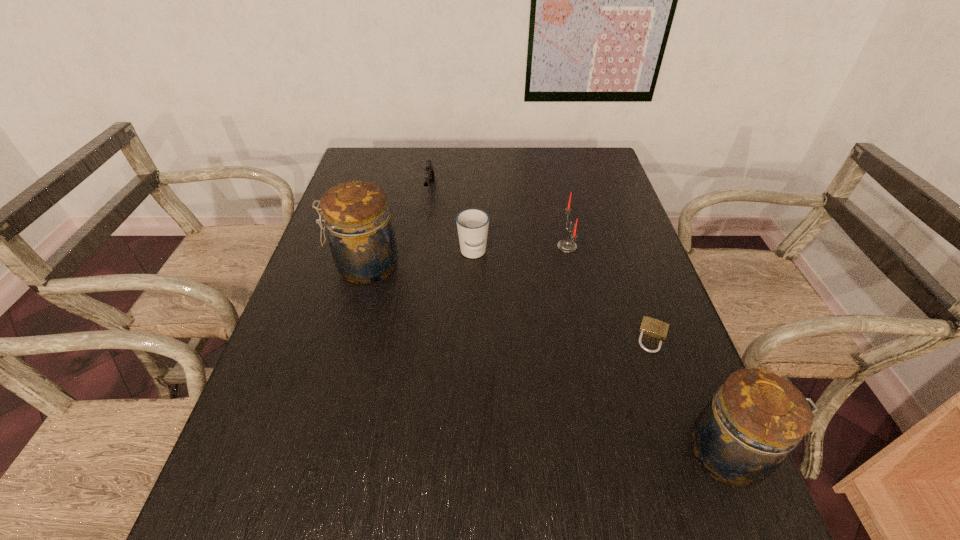
You are a GUI agent. You are given a task and a screenshot of the screen. Output one action in this format:
    pyautogui.click(x=<x>, y=<y>)
    Task: Click on the fifth farthest object
    
    Given the screenshot: What is the action you would take?
    pyautogui.click(x=652, y=327)

This screenshot has height=540, width=960. Identify the location of padlock. (652, 327).

You are a GUI agent. You are given a task and a screenshot of the screen. Output one action in this format:
    pyautogui.click(x=<x>, y=<y>)
    Task: Click on the vacant space located 0.170m with a handle on the side of the third shortest object
    This screenshot has width=960, height=540.
    Given the screenshot: What is the action you would take?
    pyautogui.click(x=472, y=314)

This screenshot has height=540, width=960. I want to click on free point located at the end of the barrel of the fifth object from right to left, so click(425, 220).

Find the location of a particular element. free space located on the front-facing side of the third object from right to left is located at coordinates (467, 246).

Find the location of `vacant space located 0.250m on the front-facing side of the third object from right to left`. vacant space located 0.250m on the front-facing side of the third object from right to left is located at coordinates (467, 246).

You are a GUI agent. You are given a task and a screenshot of the screen. Output one action in this format:
    pyautogui.click(x=<x>, y=<y>)
    Task: Click on the vacant space located 0.230m on the front-facing side of the third object from right to left
    
    Given the screenshot: What is the action you would take?
    pyautogui.click(x=474, y=246)

Image resolution: width=960 pixels, height=540 pixels. Identify the location of free space located 0.310m on the left of the shortest object. (498, 336).

At what (x,y) coordinates should I click in order to perform the action: click on object that is at the far edge. Please return your answer as a coordinate pair (x, y). The height and width of the screenshot is (540, 960). Looking at the image, I should click on (429, 171).

Where is `object present at the near edge`? The width and height of the screenshot is (960, 540). object present at the near edge is located at coordinates (741, 437).